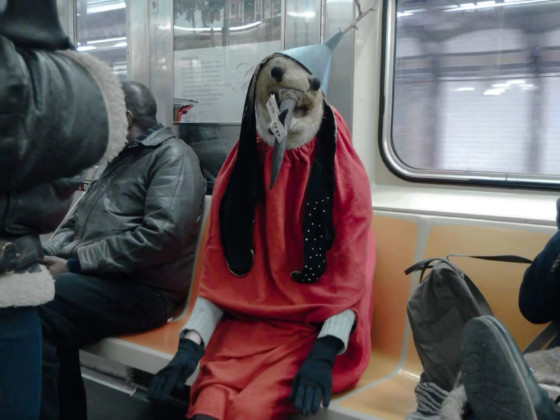
Locate an element on the screen. This screenshot has height=420, width=560. gray lines on train seats is located at coordinates (427, 221), (338, 414).